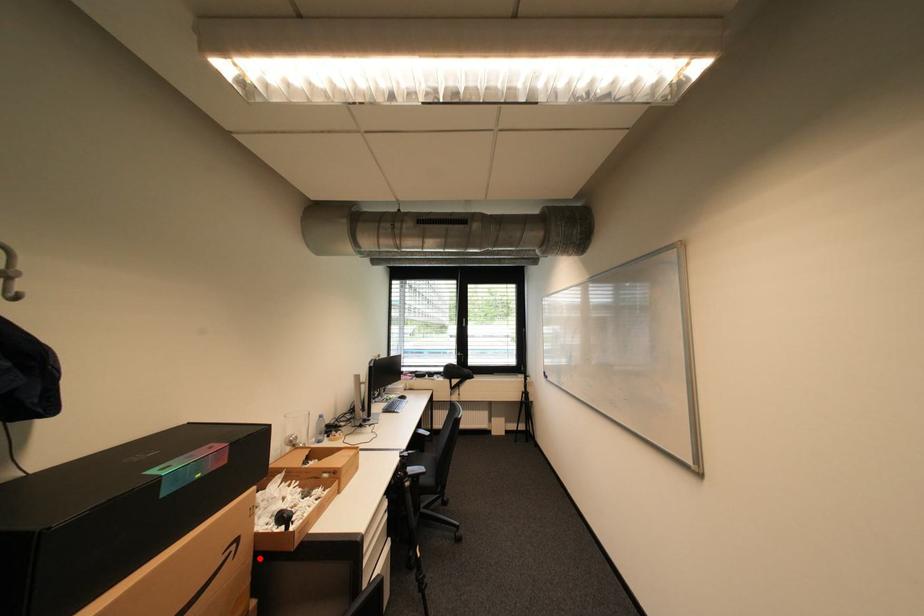
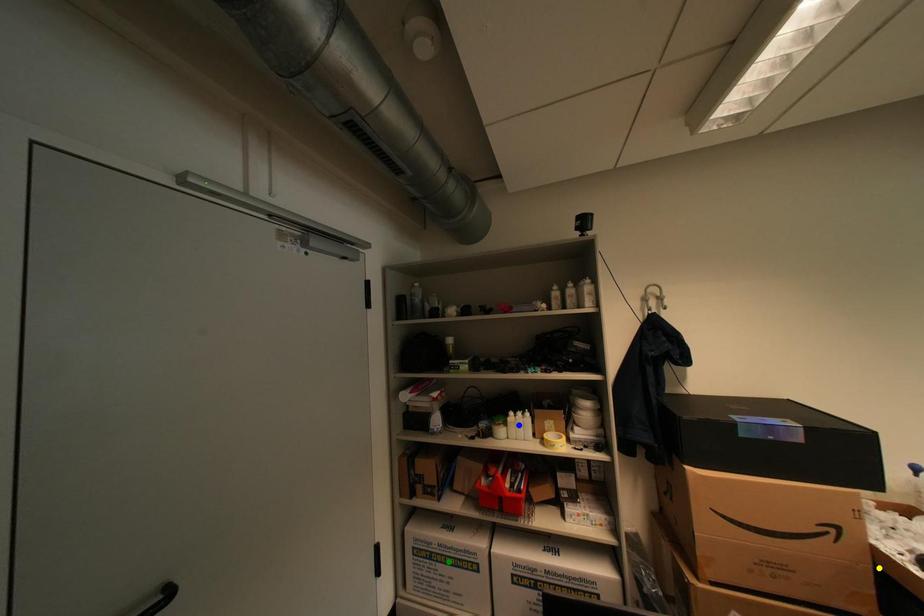
Question: I am providing you with two images of the same scene from different viewpoints. A red point is marked on the first image. You are given multiple points on the second image. Which point in image 2 is actually the same real-world point as the red point in image 1?

Choices:
 (A) green point
 (B) blue point
 (C) yellow point

Answer: (C)